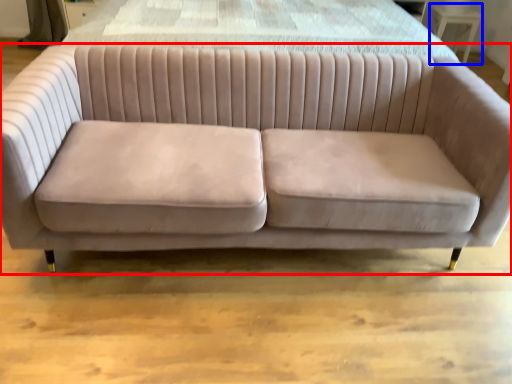
Question: Which point is further to the camera, studio couch (highlighted by a red box) or table (highlighted by a blue box)?

Choices:
 (A) studio couch
 (B) table

Answer: (B)